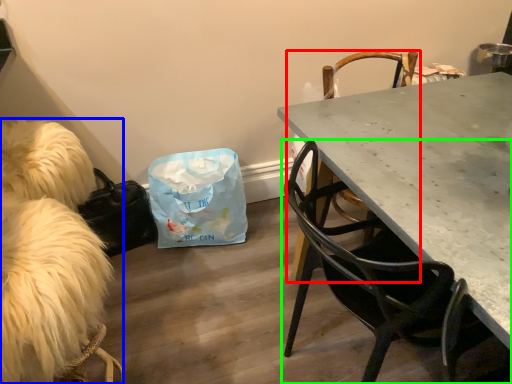
Question: Estimate the real-world distances between objects in this image. Which object is closer to chair (highlighted by a red box), animal (highlighted by a blue box) or chair (highlighted by a green box)?

Choices:
 (A) animal
 (B) chair

Answer: (B)